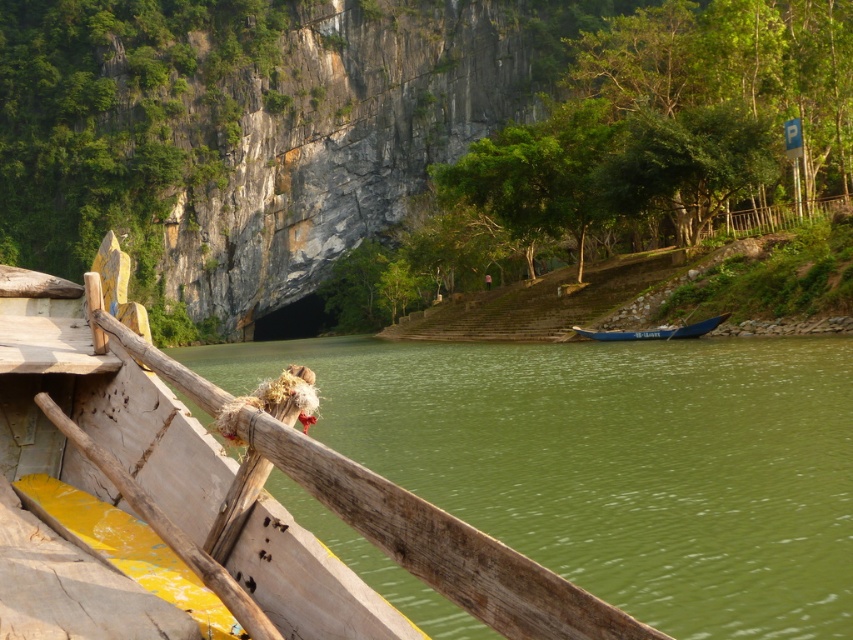
You are standing on the wooden boat in the foreground and want to throw a stone into the green smooth water at lower left. Which direction should you throw the stone to hit the water at point (x=613, y=461)?

The green smooth water at lower left is located at point (x=613, y=461), so you should throw the stone towards the lower left direction to hit the water at that coordinate.

You are a photographer standing on the wooden boat in the foreground. You want to take a photo of the blue polished wood boat at center and the green smooth water at lower left. Which object will appear lower in the photo?

The green smooth water at lower left will appear lower in the photo because it is positioned below the blue polished wood boat at center.